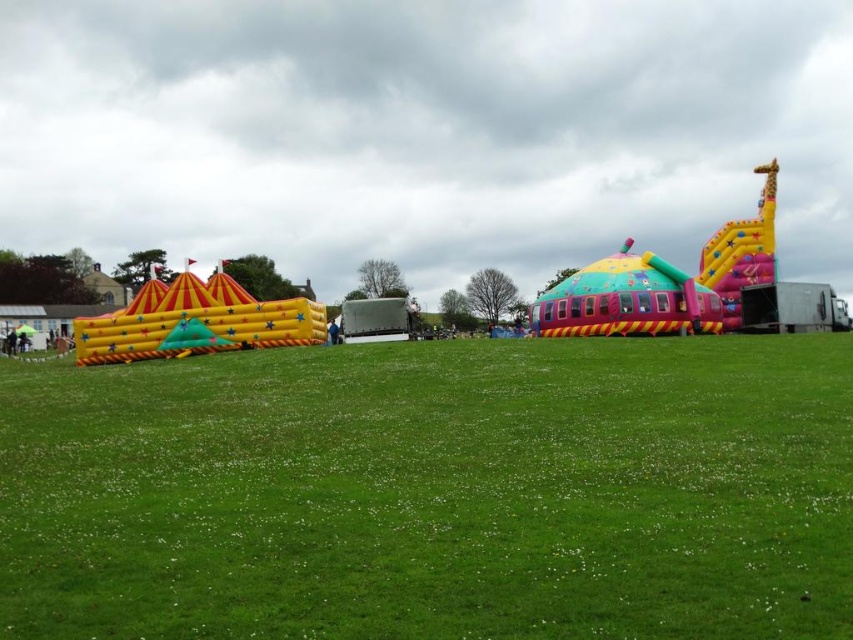
Who is more forward, [45,552] or [263,332]?

Point [45,552] is in front.

How distant is green grass at center from multicolored inflatable castle at center?

The distance of green grass at center from multicolored inflatable castle at center is 134.01 feet.

Where is `green grass at center`? This screenshot has height=640, width=853. green grass at center is located at coordinates (433, 492).